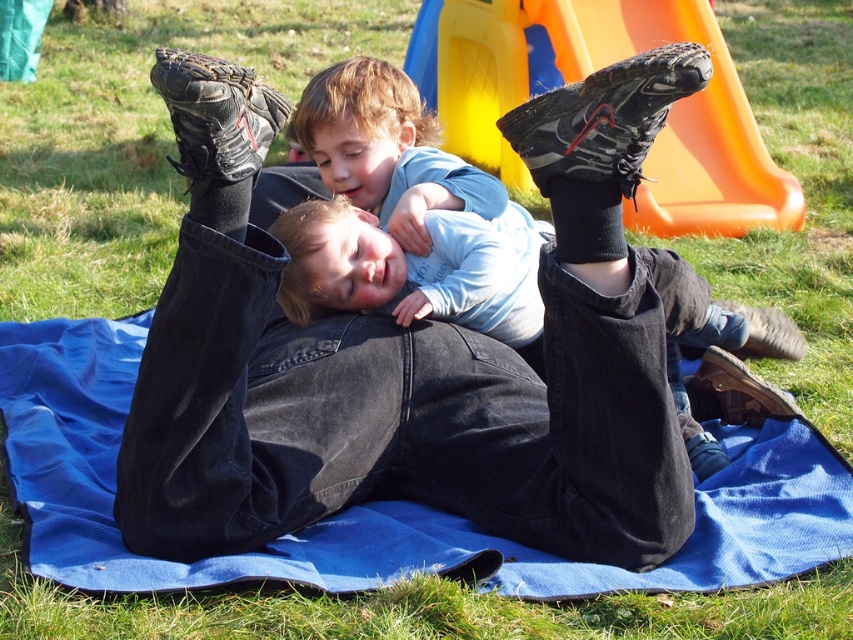
You are planning to set up a picnic area for a family gathering. You have a blue fabric blanket at center and an orange plastic slide at upper center. Which object takes up more space in the scene?

The orange plastic slide at upper center takes up more space in the scene because the blue fabric blanket at center occupies less space than it.

You are standing 10 feet away from a blue fabric blanket at center. Can you reach it without moving your feet?

The blue fabric blanket at center is 9.54 feet away from the viewer, so yes, you can reach it without moving your feet since it is within arm reach.

You are a photographer trying to capture a photo of the blue fabric blanket at center and the orange plastic slide at upper center. From the photographer perspective, which object is located to the left?

The blue fabric blanket at center is positioned on the left side of orange plastic slide at upper center, so from the photographer perspective, the blue fabric blanket at center is located to the left.